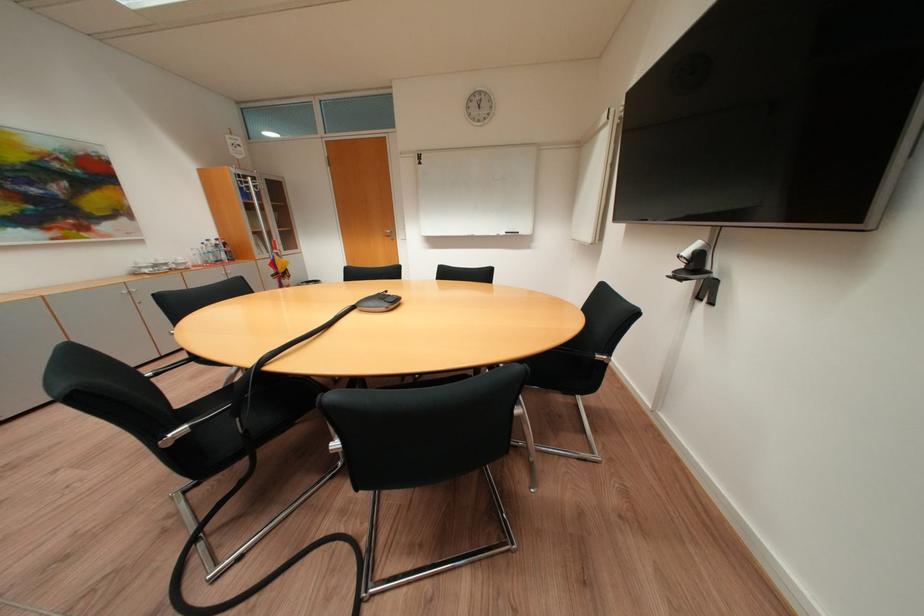
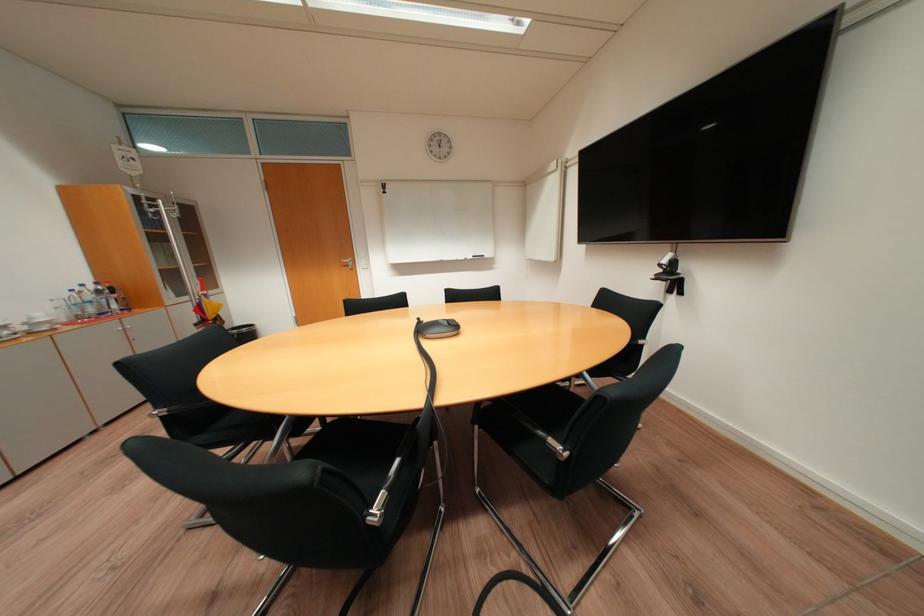
Find the pixel in the second image that matches (x=320, y=281) in the first image.

(246, 326)